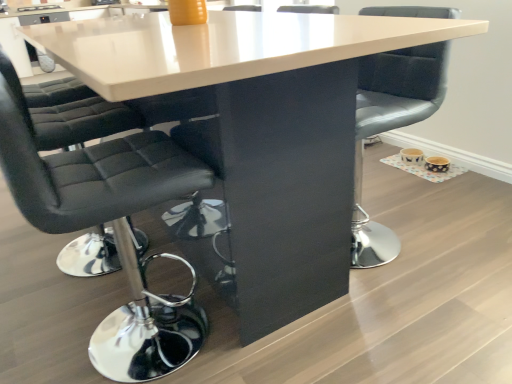
Question: From the image's perspective, is black leather chair at left, positioned as the 2th chair in right-to-left order, under matte gray cushioned chair at center, placed as the second chair when sorted from left to right?

Choices:
 (A) yes
 (B) no

Answer: (A)

Question: Considering the relative sizes of black leather chair at left, the first chair when ordered from left to right, and matte gray cushioned chair at center, which appears as the 1th chair when viewed from the right, in the image provided, is black leather chair at left, the first chair when ordered from left to right, smaller than matte gray cushioned chair at center, which appears as the 1th chair when viewed from the right,?

Choices:
 (A) yes
 (B) no

Answer: (B)

Question: Is matte gray cushioned chair at center, which appears as the 1th chair when viewed from the right, inside black leather chair at left, the first chair when ordered from left to right?

Choices:
 (A) no
 (B) yes

Answer: (A)

Question: Does black leather chair at left, the first chair when ordered from left to right, have a greater width compared to matte gray cushioned chair at center, which appears as the 1th chair when viewed from the right?

Choices:
 (A) yes
 (B) no

Answer: (A)

Question: Is black leather chair at left, positioned as the 2th chair in right-to-left order, at the left side of matte gray cushioned chair at center, placed as the second chair when sorted from left to right?

Choices:
 (A) yes
 (B) no

Answer: (A)

Question: Does black leather chair at left, positioned as the 2th chair in right-to-left order, have a larger size compared to matte gray cushioned chair at center, placed as the second chair when sorted from left to right?

Choices:
 (A) no
 (B) yes

Answer: (B)

Question: Are matte gray cushioned chair at center, placed as the second chair when sorted from left to right, and black leather chair at left, the first chair when ordered from left to right, making contact?

Choices:
 (A) yes
 (B) no

Answer: (B)

Question: Does matte gray cushioned chair at center, which appears as the 1th chair when viewed from the right, appear on the right side of black leather chair at left, the first chair when ordered from left to right?

Choices:
 (A) yes
 (B) no

Answer: (A)

Question: From a real-world perspective, is matte gray cushioned chair at center, which appears as the 1th chair when viewed from the right, located higher than black leather chair at left, the first chair when ordered from left to right?

Choices:
 (A) yes
 (B) no

Answer: (B)

Question: From the image's perspective, is matte gray cushioned chair at center, which appears as the 1th chair when viewed from the right, on top of black leather chair at left, the first chair when ordered from left to right?

Choices:
 (A) yes
 (B) no

Answer: (A)

Question: Is matte gray cushioned chair at center, placed as the second chair when sorted from left to right, closer to camera compared to black leather chair at left, the first chair when ordered from left to right?

Choices:
 (A) yes
 (B) no

Answer: (B)

Question: Is matte gray cushioned chair at center, placed as the second chair when sorted from left to right, outside of black leather chair at left, positioned as the 2th chair in right-to-left order?

Choices:
 (A) yes
 (B) no

Answer: (A)

Question: From their relative heights in the image, would you say matte gray cushioned chair at center, which appears as the 1th chair when viewed from the right, is taller or shorter than black leather chair at left, the first chair when ordered from left to right?

Choices:
 (A) tall
 (B) short

Answer: (B)